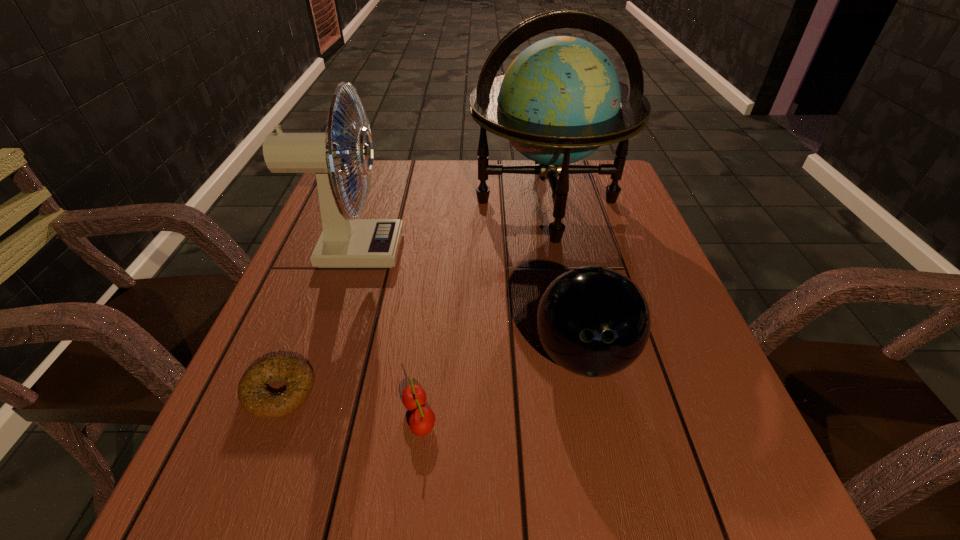
Locate an element on the screen. Image resolution: width=960 pixels, height=540 pixels. free space located on the back of the shortest object is located at coordinates [x=337, y=245].

Where is `object that is at the far edge`? object that is at the far edge is located at coordinates (560, 99).

This screenshot has width=960, height=540. I want to click on fan that is positioned at the left edge, so click(x=344, y=242).

This screenshot has height=540, width=960. What are the coordinates of `bagel located at the left edge` in the screenshot? It's located at (253, 393).

Where is `globe that is at the right edge`? This screenshot has height=540, width=960. globe that is at the right edge is located at coordinates click(560, 99).

What are the coordinates of `bowling ball present at the right edge` in the screenshot? It's located at (593, 321).

You are a GUI agent. You are given a task and a screenshot of the screen. Output one action in this format:
    pyautogui.click(x=<x>, y=<y>)
    Task: Click on the object that is at the far right corner
    
    Given the screenshot: What is the action you would take?
    pyautogui.click(x=560, y=99)

In the image, there is a desktop. Where is `vacant space at the far edge`? The image size is (960, 540). vacant space at the far edge is located at coordinates (538, 177).

At what (x,y) coordinates should I click in order to perform the action: click on vacant space at the near edge of the desktop. Please return your answer as a coordinate pair (x, y). This screenshot has height=540, width=960. Looking at the image, I should click on (410, 531).

In the image, there is a desktop. In order to click on blank space at the left edge in this screenshot , I will do `click(313, 365)`.